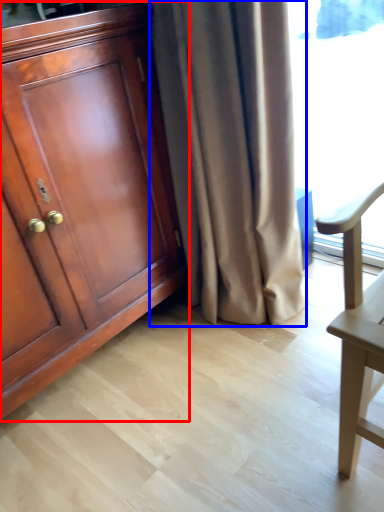
Question: Among these objects, which one is nearest to the camera, cabinetry (highlighted by a red box) or curtain (highlighted by a blue box)?

Choices:
 (A) cabinetry
 (B) curtain

Answer: (A)